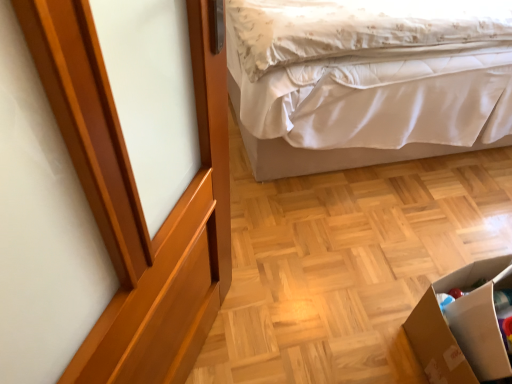
Question: Is cardboard box at lower right thinner than glossy wood screen door at upper left?

Choices:
 (A) no
 (B) yes

Answer: (A)

Question: Can you confirm if cardboard box at lower right is taller than glossy wood screen door at upper left?

Choices:
 (A) yes
 (B) no

Answer: (B)

Question: From a real-world perspective, is cardboard box at lower right over glossy wood screen door at upper left?

Choices:
 (A) no
 (B) yes

Answer: (A)

Question: Does cardboard box at lower right touch glossy wood screen door at upper left?

Choices:
 (A) no
 (B) yes

Answer: (A)

Question: Is the position of cardboard box at lower right less distant than that of glossy wood screen door at upper left?

Choices:
 (A) yes
 (B) no

Answer: (B)

Question: Considering the relative sizes of cardboard box at lower right and glossy wood screen door at upper left in the image provided, is cardboard box at lower right bigger than glossy wood screen door at upper left?

Choices:
 (A) yes
 (B) no

Answer: (B)

Question: Is white satin bed at upper right not inside cardboard box at lower right?

Choices:
 (A) no
 (B) yes

Answer: (B)

Question: Is white satin bed at upper right positioned behind cardboard box at lower right?

Choices:
 (A) yes
 (B) no

Answer: (A)

Question: Is white satin bed at upper right taller than cardboard box at lower right?

Choices:
 (A) yes
 (B) no

Answer: (A)

Question: From a real-world perspective, is white satin bed at upper right below cardboard box at lower right?

Choices:
 (A) yes
 (B) no

Answer: (B)

Question: Can you confirm if white satin bed at upper right is thinner than cardboard box at lower right?

Choices:
 (A) yes
 (B) no

Answer: (B)

Question: Does white satin bed at upper right appear on the right side of cardboard box at lower right?

Choices:
 (A) yes
 (B) no

Answer: (A)

Question: Considering the relative sizes of glossy wood screen door at upper left and cardboard box at lower right in the image provided, is glossy wood screen door at upper left bigger than cardboard box at lower right?

Choices:
 (A) yes
 (B) no

Answer: (A)